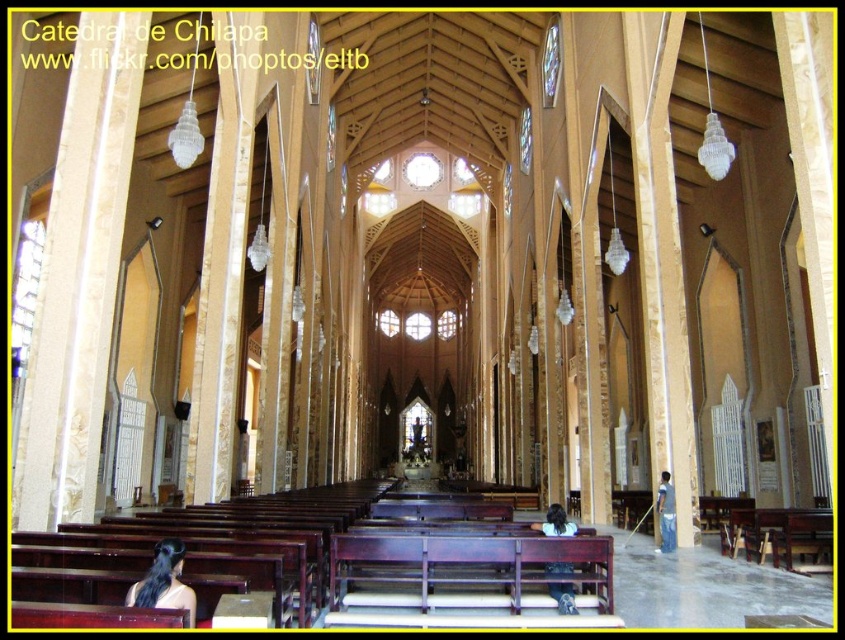
Question: Among these objects, which one is nearest to the camera?

Choices:
 (A) light brown wooden bench at lower center
 (B) black hair at center

Answer: (B)

Question: Where is black hair at center located in relation to light brown wooden bench at lower center in the image?

Choices:
 (A) right
 (B) left

Answer: (B)

Question: Can you confirm if black hair at center is positioned to the left of light brown wooden bench at lower center?

Choices:
 (A) no
 (B) yes

Answer: (B)

Question: Can you confirm if black hair at center is wider than light brown wooden bench at lower center?

Choices:
 (A) no
 (B) yes

Answer: (A)